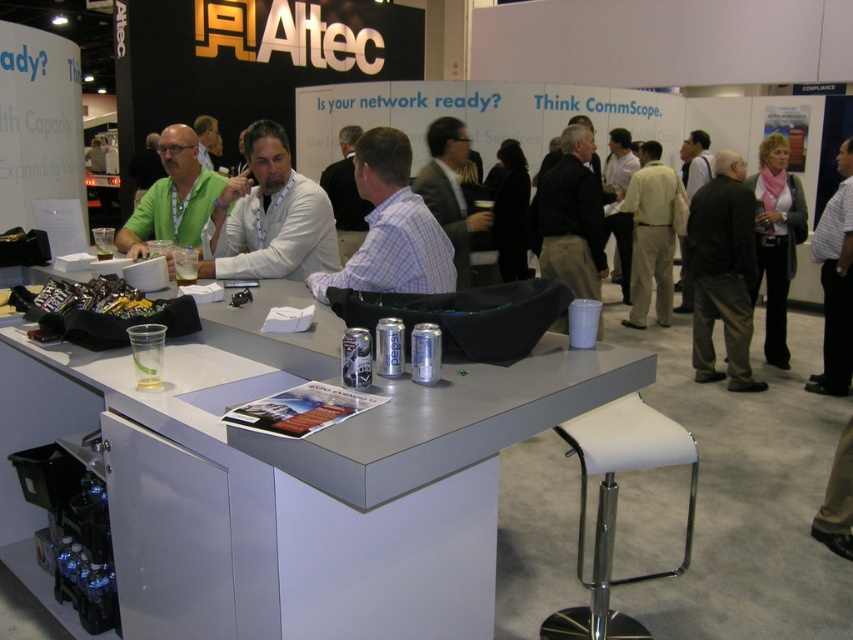
From the picture: Can you confirm if dark brown pants at right is shorter than pink fabric scarf at right?

Indeed, dark brown pants at right has a lesser height compared to pink fabric scarf at right.

Is dark brown pants at right positioned at the back of pink fabric scarf at right?

No, dark brown pants at right is in front of pink fabric scarf at right.

The height and width of the screenshot is (640, 853). Describe the element at coordinates (722, 273) in the screenshot. I see `dark brown pants at right` at that location.

Locate an element on the screen. Image resolution: width=853 pixels, height=640 pixels. dark brown pants at right is located at coordinates (722, 273).

Between pink fabric scarf at right and striped shirt at center, which one has less height?

Standing shorter between the two is striped shirt at center.

Who is positioned more to the left, pink fabric scarf at right or striped shirt at center?

pink fabric scarf at right is more to the left.

Between point (772, 134) and point (842, 150), which one is positioned in front?

Point (842, 150) is in front.

Find the location of a particular element. The image size is (853, 640). pink fabric scarf at right is located at coordinates (776, 240).

Is white glossy table at center positioned before white checkered shirt at center?

Yes, it is in front of white checkered shirt at center.

Locate an element on the screen. white glossy table at center is located at coordinates (291, 477).

You are a GUI agent. You are given a task and a screenshot of the screen. Output one action in this format:
    pyautogui.click(x=<x>, y=<y>)
    Task: Click on the white glossy table at center
    Image resolution: width=853 pixels, height=640 pixels.
    Given the screenshot: What is the action you would take?
    pyautogui.click(x=291, y=477)